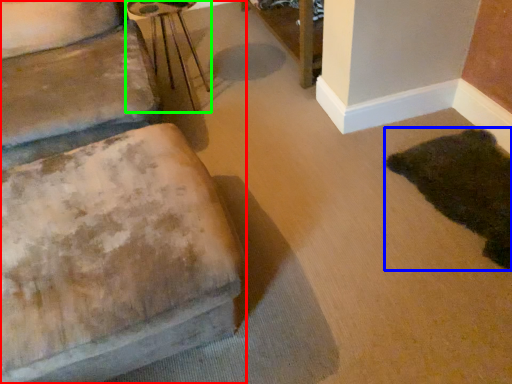
Question: Considering the real-world distances, which object is closest to furniture (highlighted by a red box)? animal (highlighted by a blue box) or side table (highlighted by a green box).

Choices:
 (A) animal
 (B) side table

Answer: (A)